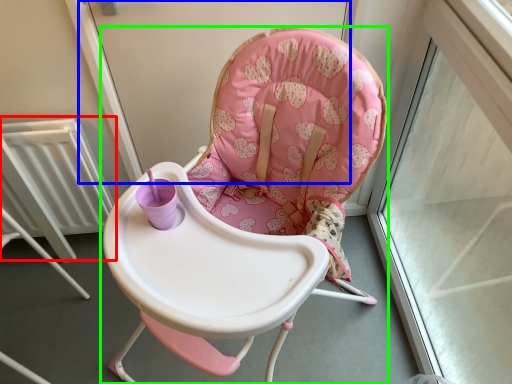
Question: Which is farther away from radiator (highlighted by a red box)? screen door (highlighted by a blue box) or chair (highlighted by a green box)?

Choices:
 (A) screen door
 (B) chair

Answer: (B)